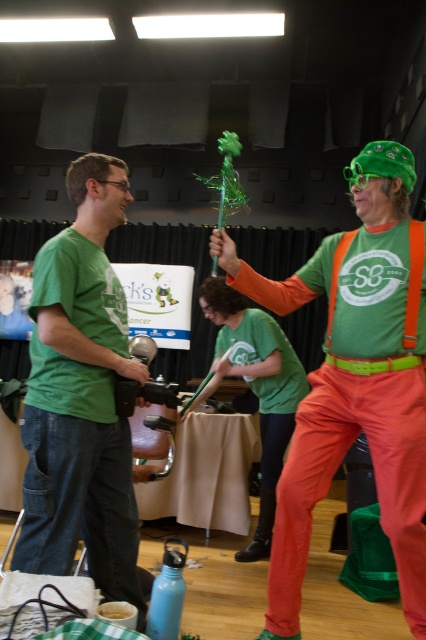
Which is in front, point (287, 518) or point (114, 225)?

Point (287, 518)

Is matte green t-shirt at center behind green matte shirt at left?

Yes.

Which is behind, point (414, 387) or point (51, 552)?

The point (414, 387) is more distant.

Locate an element on the screen. The width and height of the screenshot is (426, 640). matte green t-shirt at center is located at coordinates (356, 401).

Is point (284, 486) less distant than point (224, 339)?

Yes.

Who is lower down, matte green t-shirt at center or green matte t-shirt at center?

green matte t-shirt at center is below.

You are a GUI agent. You are given a task and a screenshot of the screen. Output one action in this format:
    pyautogui.click(x=<x>, y=<y>)
    Task: Click on the matte green t-shirt at center
    This screenshot has width=426, height=640.
    Given the screenshot: What is the action you would take?
    pyautogui.click(x=356, y=401)

Where is `matte green t-shirt at center`? This screenshot has width=426, height=640. matte green t-shirt at center is located at coordinates point(356,401).

Is point (78, 276) closer to viewer compared to point (235, 316)?

That is True.

Can you confirm if green matte shirt at left is positioned above green matte t-shirt at center?

Indeed, green matte shirt at left is positioned over green matte t-shirt at center.

Who is more distant from viewer, [23,525] or [273,436]?

The point [273,436] is more distant.

The height and width of the screenshot is (640, 426). In order to click on green matte shirt at left in this screenshot , I will do `click(80, 397)`.